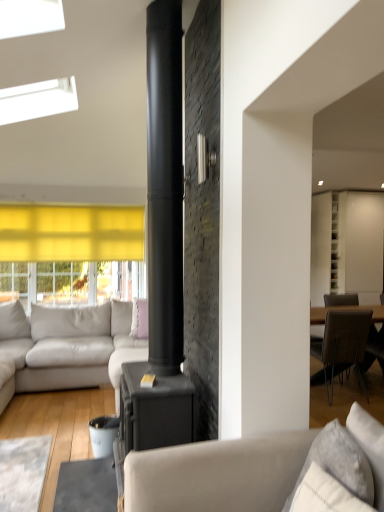
This screenshot has height=512, width=384. What do you see at coordinates (139, 318) in the screenshot?
I see `pink fabric pillow at center, which is the second pillow in right-to-left order` at bounding box center [139, 318].

The height and width of the screenshot is (512, 384). Describe the element at coordinates (70, 345) in the screenshot. I see `light gray leather couch at left, which is the 2th studio couch in front-to-back order` at that location.

Identify the location of pink fabric pillow at center, which is the second pillow in right-to-left order. (139, 318).

How different are the orientations of white textured pillow at lower right, the first pillow positioned from the front, and matte gray couch at center, placed as the first studio couch when sorted from front to back, in degrees?

11.9 degrees separate the facing orientations of white textured pillow at lower right, the first pillow positioned from the front, and matte gray couch at center, placed as the first studio couch when sorted from front to back.

From a real-world perspective, which is physically above, white textured pillow at lower right, the 2th pillow positioned from the left, or matte gray couch at center, placed as the first studio couch when sorted from front to back?

white textured pillow at lower right, the 2th pillow positioned from the left, is physically above.

Does white textured pillow at lower right, the first pillow positioned from the front, turn towards matte gray couch at center, arranged as the second studio couch when viewed from the back?

Yes, white textured pillow at lower right, the first pillow positioned from the front, faces towards matte gray couch at center, arranged as the second studio couch when viewed from the back.

Which object is wider, white textured pillow at lower right, which is the 2th pillow from back to front, or matte gray couch at center, the 2th studio couch viewed from the left?

Wider between the two is matte gray couch at center, the 2th studio couch viewed from the left.

Locate an element on the screen. Image resolution: width=384 pixels, height=512 pixels. chair below the white textured pillow at lower right, the first pillow positioned from the front (from a real-world perspective) is located at coordinates (342, 345).

Which is less distant, (337, 428) or (327, 346)?

Point (337, 428) appears to be closer to the viewer than point (327, 346).

Would you say white textured pillow at lower right, the first pillow positioned from the front, is inside or outside brown textured chair at right?

white textured pillow at lower right, the first pillow positioned from the front, exists outside the volume of brown textured chair at right.

In terms of height, does white textured pillow at lower right, arranged as the 1th pillow when viewed from the right, look taller or shorter compared to brown textured chair at right?

In the image, white textured pillow at lower right, arranged as the 1th pillow when viewed from the right, appears to be shorter than brown textured chair at right.

Which object is closer to the camera taking this photo, brown textured chair at right or matte gray couch at center, the first studio couch in the right-to-left sequence?

matte gray couch at center, the first studio couch in the right-to-left sequence, is in front.

Is point (349, 337) positioned behind point (205, 451)?

Yes, it is.

Is brown textured chair at right not close to matte gray couch at center, the first studio couch in the right-to-left sequence?

Yes, brown textured chair at right and matte gray couch at center, the first studio couch in the right-to-left sequence, are quite far apart.

Looking at this image, considering the sizes of brown textured chair at right and matte gray couch at center, placed as the first studio couch when sorted from front to back, in the image, is brown textured chair at right wider or thinner than matte gray couch at center, placed as the first studio couch when sorted from front to back,?

Clearly, brown textured chair at right has less width compared to matte gray couch at center, placed as the first studio couch when sorted from front to back.

Does white glossy cabinet at upper right appear on the left side of pink fabric pillow at center, which is the second pillow in right-to-left order?

In fact, white glossy cabinet at upper right is to the right of pink fabric pillow at center, which is the second pillow in right-to-left order.

Considering the sizes of objects white glossy cabinet at upper right and pink fabric pillow at center, the 2th pillow in the front-to-back sequence, in the image provided, who is bigger, white glossy cabinet at upper right or pink fabric pillow at center, the 2th pillow in the front-to-back sequence,?

Bigger between the two is white glossy cabinet at upper right.

From a real-world perspective, is white glossy cabinet at upper right beneath pink fabric pillow at center, which is the 1th pillow from left to right?

No, from a real-world perspective, white glossy cabinet at upper right is not under pink fabric pillow at center, which is the 1th pillow from left to right.

From the image's perspective, is white glossy cabinet at upper right above or below pink fabric pillow at center, which is the second pillow in right-to-left order?

From the image's perspective, white glossy cabinet at upper right appears above pink fabric pillow at center, which is the second pillow in right-to-left order.

In terms of width, does white glossy cabinet at upper right look wider or thinner when compared to light gray leather couch at left, marked as the 1th studio couch in a back-to-front arrangement?

white glossy cabinet at upper right is thinner than light gray leather couch at left, marked as the 1th studio couch in a back-to-front arrangement.

From their relative heights in the image, would you say white glossy cabinet at upper right is taller or shorter than light gray leather couch at left, which ranks as the 1th studio couch in left-to-right order?

white glossy cabinet at upper right is taller than light gray leather couch at left, which ranks as the 1th studio couch in left-to-right order.

From a real-world perspective, is white glossy cabinet at upper right on top of light gray leather couch at left, which is the 2th studio couch in front-to-back order?

Yes, from a real-world perspective, white glossy cabinet at upper right is above light gray leather couch at left, which is the 2th studio couch in front-to-back order.

Considering the relative positions of white glossy cabinet at upper right and light gray leather couch at left, marked as the 1th studio couch in a back-to-front arrangement, in the image provided, is white glossy cabinet at upper right to the left or to the right of light gray leather couch at left, marked as the 1th studio couch in a back-to-front arrangement,?

Clearly, white glossy cabinet at upper right is on the right of light gray leather couch at left, marked as the 1th studio couch in a back-to-front arrangement, in the image.

Between brown textured chair at right and light gray leather couch at left, the second studio couch viewed from the right, which one has smaller size?

With smaller size is brown textured chair at right.

Consider the image. Can you confirm if brown textured chair at right is positioned to the right of light gray leather couch at left, the second studio couch viewed from the right?

Yes.

From a real-world perspective, is brown textured chair at right positioned above or below light gray leather couch at left, marked as the 1th studio couch in a back-to-front arrangement?

brown textured chair at right is situated lower than light gray leather couch at left, marked as the 1th studio couch in a back-to-front arrangement, in the real world.

Is brown textured chair at right positioned before light gray leather couch at left, marked as the 1th studio couch in a back-to-front arrangement?

Yes.

Is light gray leather couch at left, marked as the 1th studio couch in a back-to-front arrangement, inside the boundaries of white glossy cabinet at upper right, or outside?

light gray leather couch at left, marked as the 1th studio couch in a back-to-front arrangement, exists outside the volume of white glossy cabinet at upper right.

Consider the image. Between light gray leather couch at left, marked as the 1th studio couch in a back-to-front arrangement, and white glossy cabinet at upper right, which one has larger width?

With larger width is light gray leather couch at left, marked as the 1th studio couch in a back-to-front arrangement.

Does light gray leather couch at left, the second studio couch viewed from the right, touch white glossy cabinet at upper right?

No, light gray leather couch at left, the second studio couch viewed from the right, is not beside white glossy cabinet at upper right.

Between light gray leather couch at left, the second studio couch viewed from the right, and white glossy cabinet at upper right, which one has smaller size?

white glossy cabinet at upper right is smaller.

Image resolution: width=384 pixels, height=512 pixels. There is a white textured pillow at lower right, which is the 2th pillow from back to front. In order to click on the 1st studio couch below it (from the image's perspective) in this screenshot , I will do [217, 474].

You are a GUI agent. You are given a task and a screenshot of the screen. Output one action in this format:
    pyautogui.click(x=<x>, y=<y>)
    Task: Click on the 1st pillow counting from the left side of the brown textured chair at right
    Image resolution: width=384 pixels, height=512 pixels.
    Given the screenshot: What is the action you would take?
    pyautogui.click(x=339, y=462)

Based on their spatial positions, is white textured pillow at lower right, which is the 2th pillow from back to front, or white glossy cabinet at upper right closer to brown textured chair at right?

The object closer to brown textured chair at right is white glossy cabinet at upper right.

Considering their positions, is white glossy cabinet at upper right positioned further to white textured pillow at lower right, the 2th pillow positioned from the left, than brown textured chair at right?

white glossy cabinet at upper right.

Estimate the real-world distances between objects in this image. Which object is closer to white textured pillow at lower right, the 2th pillow positioned from the left, pink fabric pillow at center, which is the second pillow in right-to-left order, or brown textured chair at right?

brown textured chair at right.

Based on their spatial positions, is light gray leather couch at left, which ranks as the 1th studio couch in left-to-right order, or pink fabric pillow at center, which is the second pillow in right-to-left order, further from white glossy cabinet at upper right?

light gray leather couch at left, which ranks as the 1th studio couch in left-to-right order, is further to white glossy cabinet at upper right.

Consider the image. Based on their spatial positions, is white textured pillow at lower right, which is the 2th pillow from back to front, or matte gray couch at center, arranged as the second studio couch when viewed from the back, closer to brown textured chair at right?

matte gray couch at center, arranged as the second studio couch when viewed from the back, is positioned closer to the anchor brown textured chair at right.

Estimate the real-world distances between objects in this image. Which object is further from pink fabric pillow at center, which is the 1th pillow from left to right, white textured pillow at lower right, arranged as the 1th pillow when viewed from the right, or matte gray couch at center, the 2th studio couch viewed from the left?

Among the two, white textured pillow at lower right, arranged as the 1th pillow when viewed from the right, is located further to pink fabric pillow at center, which is the 1th pillow from left to right.

Which object lies nearer to the anchor point white glossy cabinet at upper right, white textured pillow at lower right, which is the 2th pillow from back to front, or pink fabric pillow at center, the 2th pillow in the front-to-back sequence?

Based on the image, pink fabric pillow at center, the 2th pillow in the front-to-back sequence, appears to be nearer to white glossy cabinet at upper right.

Considering their positions, is light gray leather couch at left, marked as the 1th studio couch in a back-to-front arrangement, positioned closer to white glossy cabinet at upper right than white textured pillow at lower right, the first pillow positioned from the front?

light gray leather couch at left, marked as the 1th studio couch in a back-to-front arrangement, is closer to white glossy cabinet at upper right.

Locate an element on the screen. The width and height of the screenshot is (384, 512). chair located between white textured pillow at lower right, arranged as the 1th pillow when viewed from the right, and pink fabric pillow at center, which is the second pillow in right-to-left order, in the depth direction is located at coordinates (342, 345).

Image resolution: width=384 pixels, height=512 pixels. What are the coordinates of `chair between white textured pillow at lower right, the 2th pillow positioned from the left, and light gray leather couch at left, the second studio couch viewed from the right, from front to back` in the screenshot? It's located at (342, 345).

Identify the location of studio couch located between matte gray couch at center, the 2th studio couch viewed from the left, and white glossy cabinet at upper right in the depth direction. The width and height of the screenshot is (384, 512). (70, 345).

The image size is (384, 512). Find the location of `chair between matte gray couch at center, the 2th studio couch viewed from the left, and pink fabric pillow at center, which is the 1th pillow from left to right, from front to back`. chair between matte gray couch at center, the 2th studio couch viewed from the left, and pink fabric pillow at center, which is the 1th pillow from left to right, from front to back is located at coordinates (342, 345).